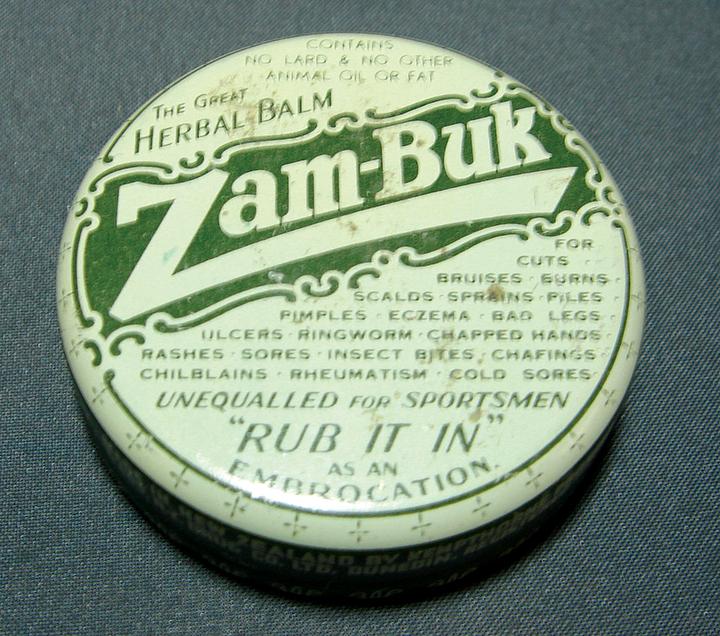
Image resolution: width=720 pixels, height=636 pixels. Identify the location of round container. (358, 93).